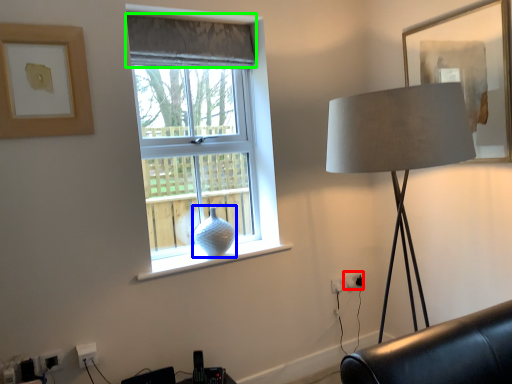
Question: Which is nearer to the electric outlet (highlighted by a red box)? glass vase (highlighted by a blue box) or curtain (highlighted by a green box).

Choices:
 (A) glass vase
 (B) curtain

Answer: (A)